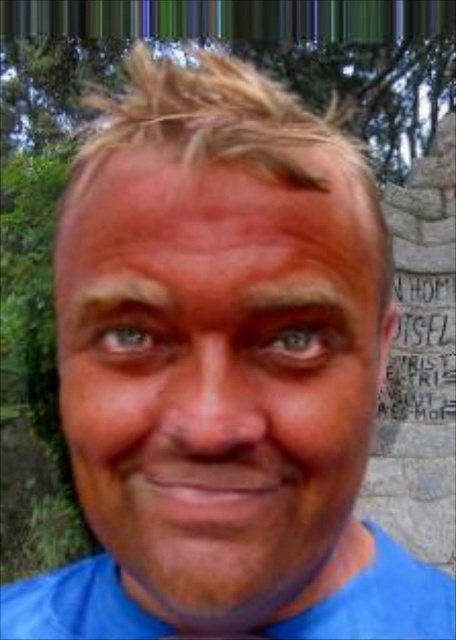
You are a photographer adjusting your camera settings to focus on the reddish skin at center and the brown matte eyebrow at upper center. Which object should you adjust your focus to first if you want to capture the one closer to the center of the image?

The reddish skin at center is closer to the center of the image than the brown matte eyebrow at upper center, so you should focus on the reddish skin at center first.

You are a photographer trying to capture the blue matte face at center and the blue cotton shirt at lower center in the same frame. Which object should you adjust your camera to focus on first if you want to ensure both are in focus, considering their positions?

The blue matte face at center is positioned on the right side of blue cotton shirt at lower center. Since the blue cotton shirt at lower center is closer to the camera, you should focus on it first to ensure both are in focus.

You are a photographer standing at the position of the camera. You need to capture a photo where both the blue cotton shirt at lower center and the brown hair at upper left are in focus. Given that your camera can only focus on objects within a 5 meter range, will you be able to achieve this?

The distance between the blue cotton shirt at lower center and the brown hair at upper left is 4.21 meters, which is within the camera focus range of 5 meters. Therefore, both objects can be in focus.